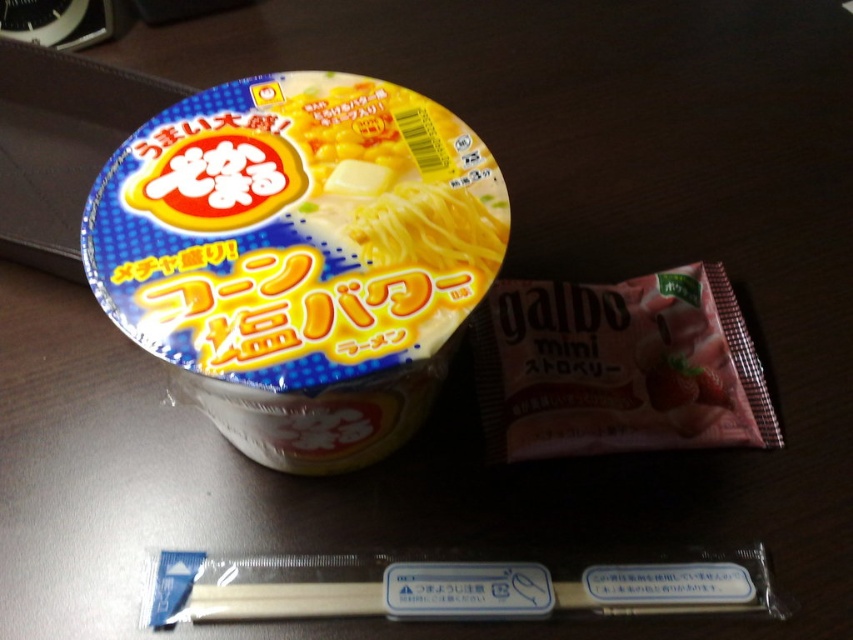
Question: Is matte plastic cup at center to the right of pink matte snack at right from the viewer's perspective?

Choices:
 (A) no
 (B) yes

Answer: (A)

Question: Among these points, which one is farthest from the camera?

Choices:
 (A) (519, 378)
 (B) (358, 429)

Answer: (A)

Question: Does matte plastic cup at center appear under pink matte snack at right?

Choices:
 (A) yes
 (B) no

Answer: (B)

Question: Is matte plastic cup at center positioned behind pink matte snack at right?

Choices:
 (A) yes
 (B) no

Answer: (B)